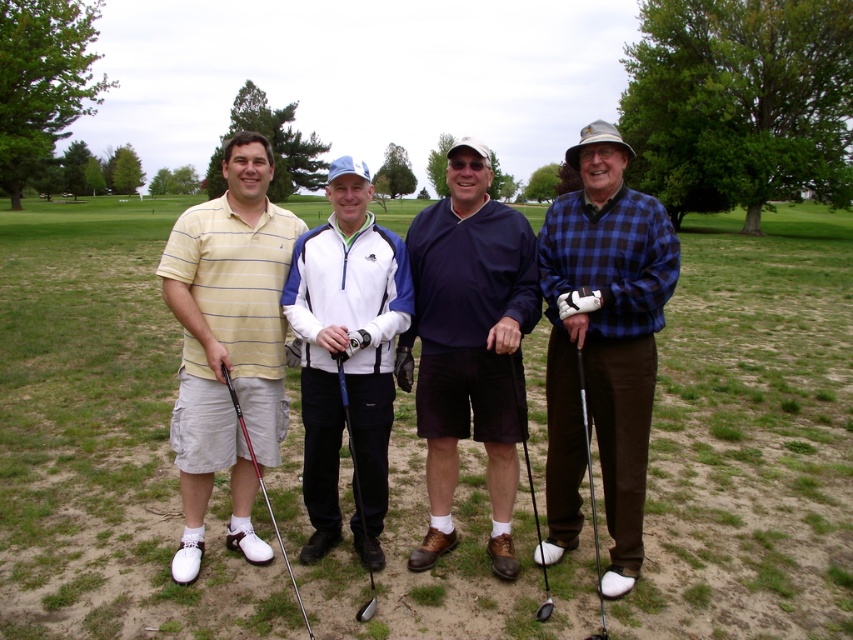
Is metallic blue golf club at center taller than metallic silver golf club at center?

No.

From the picture: Can you confirm if metallic blue golf club at center is thinner than metallic silver golf club at center?

Yes.

This screenshot has height=640, width=853. What are the coordinates of `metallic blue golf club at center` in the screenshot? It's located at (357, 496).

Find the location of a particular element. The height and width of the screenshot is (640, 853). metallic blue golf club at center is located at coordinates (357, 496).

Does blue plaid shirt at right appear on the left side of yellow striped polo shirt at left?

Incorrect, blue plaid shirt at right is not on the left side of yellow striped polo shirt at left.

Who is more forward, (643,228) or (183,547)?

Positioned in front is point (643,228).

What do you see at coordinates (602, 342) in the screenshot? The image size is (853, 640). I see `blue plaid shirt at right` at bounding box center [602, 342].

Identify the location of blue plaid shirt at right. (602, 342).

This screenshot has width=853, height=640. Describe the element at coordinates (602, 342) in the screenshot. I see `blue plaid shirt at right` at that location.

Is point (675, 241) behind point (581, 372)?

Yes, it is behind point (581, 372).

Between point (628, 300) and point (576, 356), which one is positioned behind?

Point (576, 356)

At what (x,y) coordinates should I click in order to perform the action: click on blue plaid shirt at right. Please return your answer as a coordinate pair (x, y). This screenshot has height=640, width=853. Looking at the image, I should click on (602, 342).